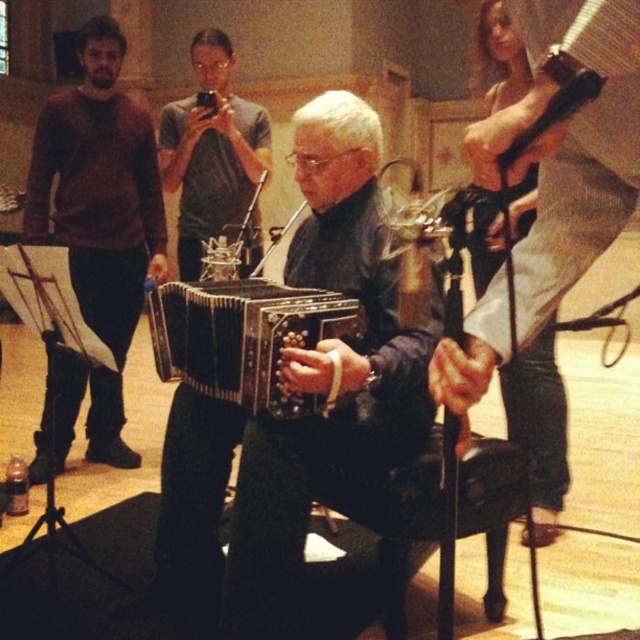
You are a photographer setting up a tripod in the center of the room. You want to capture a closeup of the wooden accordion at center without the matte gray shirt at center blocking the view. Given their relative heights, will the shirt block the view of the accordion?

The wooden accordion at center has a greater height compared to the matte gray shirt at center, so the shirt will not block the view of the accordion as it is shorter than the accordion.

You are holding a camera and want to take a photo of the wooden accordion at center. The camera requires a minimum distance of 2 meters to focus properly. Can you take a clear photo from your current position?

The wooden accordion at center and camera are 1.88 meters apart, which is less than the required 2 meters for proper focus. Move closer to ensure a clear photo.

You are a photographer taking a portrait of the two subjects in the scene. The subjects are wearing a brown sweater at left and a matte gray shirt at center. Based on their positions, which subject should you focus on first to ensure both are in frame?

The brown sweater at left is below the matte gray shirt at center, so you should focus on the matte gray shirt at center first to ensure both are in frame.